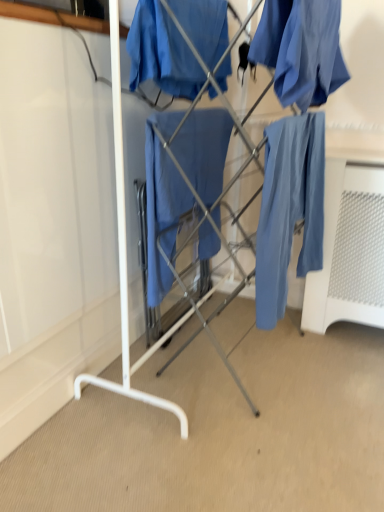
What is the approximate width of matte blue fabric at center?

It is 24.05 inches.

Measure the distance between matte blue fabric at center, the 2th clothing viewed from the right, and camera.

The distance of matte blue fabric at center, the 2th clothing viewed from the right, from camera is 4.02 feet.

Image resolution: width=384 pixels, height=512 pixels. What do you see at coordinates (289, 209) in the screenshot?
I see `matte blue pants at right` at bounding box center [289, 209].

Measure the distance between point (205, 130) and camera.

5.43 feet.

In order to click on matte blue fabric at center in this screenshot , I will do `click(126, 257)`.

Identify the location of cloak lying below the matte blue fabric at upper right, which ranks as the 1th clothing in right-to-left order (from the image's perspective). The height and width of the screenshot is (512, 384). (162, 201).

Is matte blue fabric at upper right, marked as the second clothing in a left-to-right arrangement, wider than matte blue fabric at center?

Correct, the width of matte blue fabric at upper right, marked as the second clothing in a left-to-right arrangement, exceeds that of matte blue fabric at center.

Does point (280, 69) lie behind point (173, 245)?

No, it is not.

Are matte blue fabric at upper right, which ranks as the 1th clothing in right-to-left order, and matte blue fabric at center beside each other?

There is a gap between matte blue fabric at upper right, which ranks as the 1th clothing in right-to-left order, and matte blue fabric at center.

Is the depth of matte blue fabric at center, the first clothing from the left, greater than that of matte blue fabric at upper right, marked as the second clothing in a left-to-right arrangement?

That is True.

From the image's perspective, which is above, matte blue fabric at center, the 2th clothing viewed from the right, or matte blue fabric at upper right, marked as the second clothing in a left-to-right arrangement?

matte blue fabric at center, the 2th clothing viewed from the right, from the image's perspective.

Based on their sizes in the image, would you say matte blue fabric at center, the first clothing from the left, is bigger or smaller than matte blue fabric at upper right, marked as the second clothing in a left-to-right arrangement?

Clearly, matte blue fabric at center, the first clothing from the left, is smaller in size than matte blue fabric at upper right, marked as the second clothing in a left-to-right arrangement.

Identify the location of clothing positioned vertically above the matte blue fabric at upper right, which ranks as the 1th clothing in right-to-left order (from a real-world perspective). The width and height of the screenshot is (384, 512). (161, 53).

Considering the sizes of objects matte blue fabric at center and matte blue fabric at upper right, which ranks as the 1th clothing in right-to-left order, in the image provided, who is wider, matte blue fabric at center or matte blue fabric at upper right, which ranks as the 1th clothing in right-to-left order,?

Wider between the two is matte blue fabric at center.

Is matte blue fabric at center inside the boundaries of matte blue fabric at upper right, which ranks as the 1th clothing in right-to-left order, or outside?

matte blue fabric at center is not inside matte blue fabric at upper right, which ranks as the 1th clothing in right-to-left order, it's outside.

In the image, is matte blue fabric at center on the left side or the right side of matte blue fabric at upper right, which ranks as the 1th clothing in right-to-left order?

Based on their positions, matte blue fabric at center is located to the left of matte blue fabric at upper right, which ranks as the 1th clothing in right-to-left order.

At what (x,y) coordinates should I click in order to perform the action: click on cloak that appears behind the matte blue fabric at center. Please return your answer as a coordinate pair (x, y). The width and height of the screenshot is (384, 512). Looking at the image, I should click on (162, 201).

From the image's perspective, is matte blue fabric at center under matte blue fabric at center?

Incorrect, from the image's perspective, matte blue fabric at center is higher than matte blue fabric at center.

Is matte blue fabric at center at the right side of matte blue fabric at center?

Yes, matte blue fabric at center is to the right of matte blue fabric at center.

Which object is closer to the camera taking this photo, matte blue fabric at center or matte blue fabric at center?

matte blue fabric at center is in front.

Would you say matte blue fabric at center is inside or outside matte blue pants at right?

matte blue fabric at center is outside matte blue pants at right.

Can you confirm if matte blue fabric at center is wider than matte blue pants at right?

Correct, the width of matte blue fabric at center exceeds that of matte blue pants at right.

Is the position of matte blue fabric at center less distant than that of matte blue pants at right?

Yes, it is in front of matte blue pants at right.

Looking at this image, what's the angular difference between matte blue fabric at center and matte blue pants at right's facing directions?

The facing directions of matte blue fabric at center and matte blue pants at right are 87.8 degrees apart.

From the image's perspective, which is below, matte blue fabric at upper right, marked as the second clothing in a left-to-right arrangement, or matte blue fabric at center, the first clothing from the left?

From the image's view, matte blue fabric at upper right, marked as the second clothing in a left-to-right arrangement, is below.

Between matte blue fabric at upper right, marked as the second clothing in a left-to-right arrangement, and matte blue fabric at center, the 2th clothing viewed from the right, which one is positioned in front?

matte blue fabric at upper right, marked as the second clothing in a left-to-right arrangement, is closer to the camera.

Are matte blue fabric at upper right, which ranks as the 1th clothing in right-to-left order, and matte blue fabric at center, the 2th clothing viewed from the right, far apart?

Actually, matte blue fabric at upper right, which ranks as the 1th clothing in right-to-left order, and matte blue fabric at center, the 2th clothing viewed from the right, are a little close together.

Who is shorter, matte blue fabric at upper right, which ranks as the 1th clothing in right-to-left order, or matte blue fabric at center, the 2th clothing viewed from the right?

matte blue fabric at upper right, which ranks as the 1th clothing in right-to-left order.

Is matte blue fabric at center not close to matte blue fabric at center, the 2th clothing viewed from the right?

They are positioned close to each other.

Is matte blue fabric at center aimed at matte blue fabric at center, the first clothing from the left?

No, matte blue fabric at center is not oriented towards matte blue fabric at center, the first clothing from the left.

Which object is wider, matte blue fabric at center or matte blue fabric at center, the first clothing from the left?

matte blue fabric at center.

Where is `cloak behind the matte blue fabric at upper right, which ranks as the 1th clothing in right-to-left order`? cloak behind the matte blue fabric at upper right, which ranks as the 1th clothing in right-to-left order is located at coordinates (162, 201).

You are a GUI agent. You are given a task and a screenshot of the screen. Output one action in this format:
    pyautogui.click(x=<x>, y=<y>)
    Task: Click on the clothing located in front of the matte blue fabric at center, the 2th clothing viewed from the right
    Image resolution: width=384 pixels, height=512 pixels.
    Given the screenshot: What is the action you would take?
    pyautogui.click(x=301, y=49)

Estimate the real-world distances between objects in this image. Which object is closer to matte blue fabric at center, the 2th clothing viewed from the right, matte blue pants at right or matte blue fabric at upper right, which ranks as the 1th clothing in right-to-left order?

Based on the image, matte blue fabric at upper right, which ranks as the 1th clothing in right-to-left order, appears to be nearer to matte blue fabric at center, the 2th clothing viewed from the right.

Estimate the real-world distances between objects in this image. Which object is further from matte blue pants at right, matte blue fabric at upper right, which ranks as the 1th clothing in right-to-left order, or matte blue fabric at center?

Among the two, matte blue fabric at center is located further to matte blue pants at right.

Looking at the image, which one is located further to matte blue pants at right, matte blue fabric at center or matte blue fabric at center?

The object further to matte blue pants at right is matte blue fabric at center.

From the image, which object appears to be farther from matte blue pants at right, matte blue fabric at center, the first clothing from the left, or matte blue fabric at upper right, which ranks as the 1th clothing in right-to-left order?

matte blue fabric at center, the first clothing from the left, lies further to matte blue pants at right than the other object.

Based on their spatial positions, is matte blue fabric at center or matte blue fabric at center, the first clothing from the left, further from matte blue pants at right?

matte blue fabric at center, the first clothing from the left, is positioned further to the anchor matte blue pants at right.

Consider the image. When comparing their distances from matte blue fabric at center, does matte blue fabric at center or matte blue pants at right seem further?

matte blue pants at right.

When comparing their distances from matte blue pants at right, does matte blue fabric at center or matte blue fabric at upper right, marked as the second clothing in a left-to-right arrangement, seem further?

matte blue fabric at center lies further to matte blue pants at right than the other object.

Estimate the real-world distances between objects in this image. Which object is closer to matte blue fabric at center, matte blue fabric at center, the first clothing from the left, or matte blue pants at right?

matte blue fabric at center, the first clothing from the left, lies closer to matte blue fabric at center than the other object.

You are a GUI agent. You are given a task and a screenshot of the screen. Output one action in this format:
    pyautogui.click(x=<x>, y=<y>)
    Task: Click on the furniture between matte blue fabric at upper right, which ranks as the 1th clothing in right-to-left order, and matte blue fabric at center, in the vertical direction
    
    Given the screenshot: What is the action you would take?
    pyautogui.click(x=126, y=257)

At what (x,y) coordinates should I click in order to perform the action: click on furniture between matte blue fabric at center, the 2th clothing viewed from the right, and matte blue pants at right vertically. Please return your answer as a coordinate pair (x, y). Looking at the image, I should click on (126, 257).

Identify the location of clothing between matte blue fabric at center, the first clothing from the left, and matte blue fabric at center vertically. This screenshot has height=512, width=384. (301, 49).

Find the location of a particular element. This screenshot has height=512, width=384. clothing between matte blue fabric at center, the 2th clothing viewed from the right, and matte blue pants at right in the up-down direction is located at coordinates (301, 49).